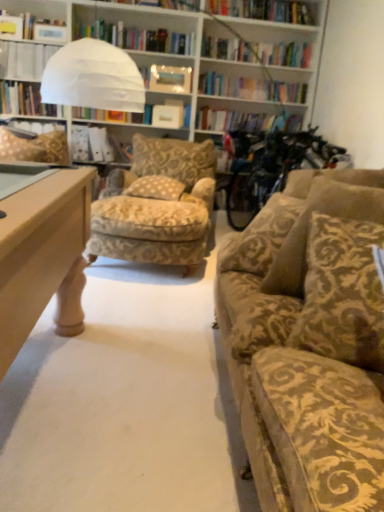
Question: Is beige damask pillow at center, the 2th pillow when ordered from left to right, in front of or behind gold-patterned fabric chair at center in the image?

Choices:
 (A) front
 (B) behind

Answer: (B)

Question: Is beige damask pillow at center, the 2th pillow viewed from the back, wider or thinner than gold-patterned fabric chair at center?

Choices:
 (A) thin
 (B) wide

Answer: (A)

Question: Which of these objects is positioned closest to the gold damask pillow at left, positioned as the first pillow in left-to-right order?

Choices:
 (A) white paper bag at center, which is the 1th book from right to left
 (B) velvet gold pillow at right, arranged as the third pillow when viewed from the back
 (C) beige damask pillow at center, which appears as the 3th pillow when viewed from the front
 (D) gold-patterned fabric chair at center
 (E) white paper at upper left, marked as the first book in a left-to-right arrangement

Answer: (A)

Question: Estimate the real-world distances between objects in this image. Which object is closer to the beige damask pillow at center, the 2th pillow viewed from the back?

Choices:
 (A) white paper at upper left, marked as the 2th book in a right-to-left arrangement
 (B) velvet gold-patterned couch at right
 (C) gold-patterned fabric chair at center
 (D) gold damask pillow at left, the fourth pillow viewed from the right
 (E) velvet gold pillow at right, positioned as the 2th pillow in front-to-back order

Answer: (C)